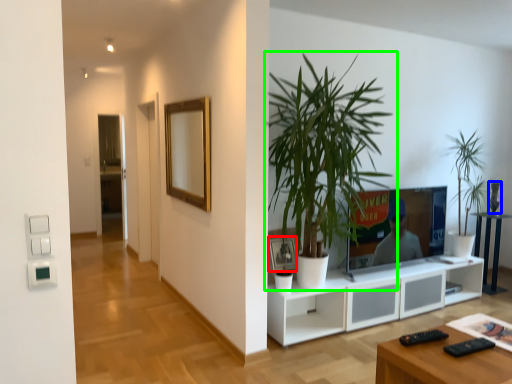
Question: Which object is positioned farthest from picture frame (highlighted by a red box)? Select from vase (highlighted by a blue box) and houseplant (highlighted by a green box).

Choices:
 (A) vase
 (B) houseplant

Answer: (A)